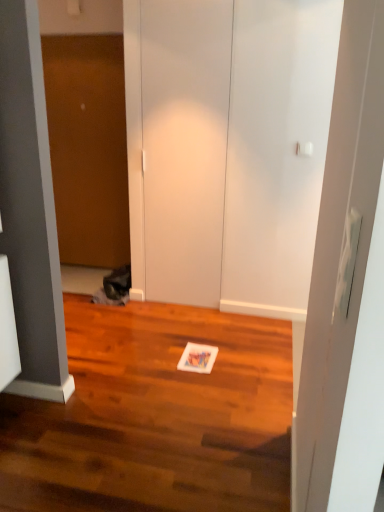
Question: From a real-world perspective, is wooden door at left, which is counted as the 1th door, starting from the back, positioned over white matte door at center, the first door from the front, based on gravity?

Choices:
 (A) no
 (B) yes

Answer: (A)

Question: Can you confirm if wooden door at left, which ranks as the 1th door in left-to-right order, is positioned to the right of white matte door at center, acting as the 1th door starting from the right?

Choices:
 (A) no
 (B) yes

Answer: (A)

Question: Does wooden door at left, the second door from the front, turn towards white matte door at center, the first door from the front?

Choices:
 (A) no
 (B) yes

Answer: (A)

Question: Considering the relative sizes of wooden door at left, which ranks as the 1th door in left-to-right order, and white matte door at center, the 2th door from the left, in the image provided, is wooden door at left, which ranks as the 1th door in left-to-right order, taller than white matte door at center, the 2th door from the left,?

Choices:
 (A) yes
 (B) no

Answer: (B)

Question: Can you confirm if wooden door at left, which is counted as the 1th door, starting from the back, is shorter than white matte door at center, the first door from the front?

Choices:
 (A) yes
 (B) no

Answer: (A)

Question: From the image's perspective, does wooden door at left, which ranks as the 1th door in left-to-right order, appear lower than white matte door at center, the 2th door from the left?

Choices:
 (A) yes
 (B) no

Answer: (B)

Question: Would you say wooden door at left, which ranks as the 1th door in left-to-right order, is part of white matte door at center, the first door from the front,'s contents?

Choices:
 (A) no
 (B) yes

Answer: (A)

Question: Considering the relative positions of white matte door at center, the first door from the front, and wooden door at left, which ranks as the 1th door in left-to-right order, in the image provided, is white matte door at center, the first door from the front, to the left of wooden door at left, which ranks as the 1th door in left-to-right order, from the viewer's perspective?

Choices:
 (A) no
 (B) yes

Answer: (A)

Question: Is white matte door at center, the 2th door from the left, wider than wooden door at left, the second door from the front?

Choices:
 (A) yes
 (B) no

Answer: (B)

Question: From a real-world perspective, is white matte door at center, acting as the second door starting from the back, on wooden door at left, which is counted as the 1th door, starting from the back?

Choices:
 (A) yes
 (B) no

Answer: (A)

Question: From a real-world perspective, is white matte door at center, the 2th door from the left, under wooden door at left, which ranks as the 1th door in left-to-right order?

Choices:
 (A) yes
 (B) no

Answer: (B)

Question: Is white matte door at center, the 2th door from the left, outside of wooden door at left, the second door from the front?

Choices:
 (A) no
 (B) yes

Answer: (B)

Question: From the image's perspective, is wooden door at left, the second door from the front, positioned above or below white matte door at center, the first door from the front?

Choices:
 (A) below
 (B) above

Answer: (B)